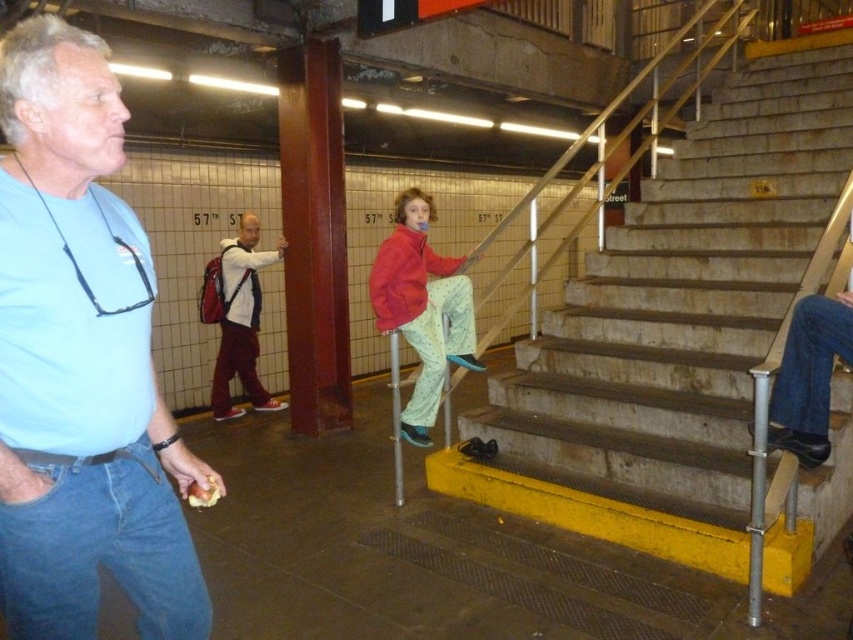
You are standing at the entrance of the subway station and want to find the concrete stairs at center. According to the coordinates given, where should you look to find them?

The concrete stairs at center are located at the coordinates point (675, 330).

You are standing at the entrance of the subway station and see the point marked at coordinates (x=675, y=330). Based on the scene description, where is this point located?

The point marked at coordinates (x=675, y=330) is located on the concrete stairs at center.